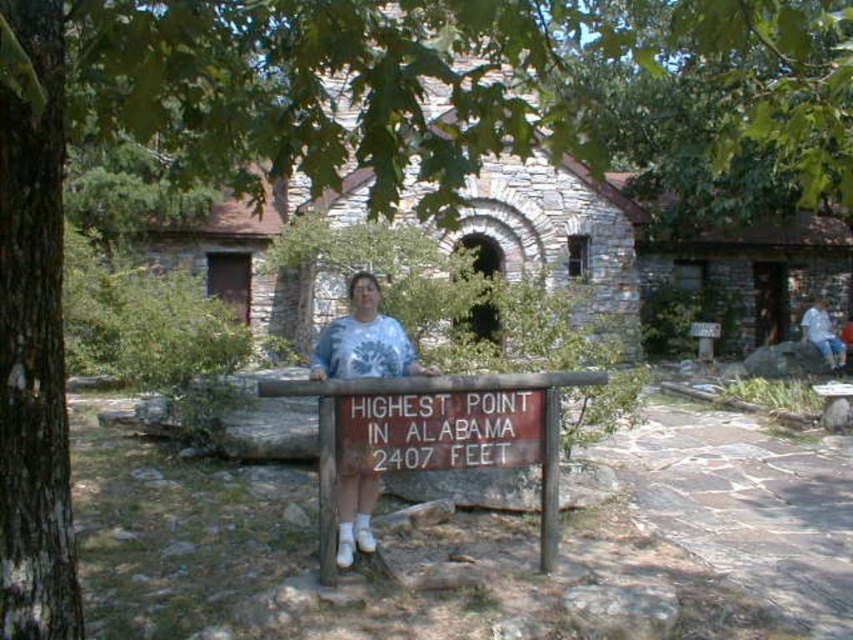
You are standing at the highest point in Alabama and want to take a photo with the brown wooden sign at center. You notice the blue denim jeans at right in the frame. To ensure the entire sign is visible, should you move closer to or farther from the sign?

The brown wooden sign at center might be wider than blue denim jeans at right, so you should move closer to the sign to ensure its entire width fits in the photo frame.

You are a photographer planning to take a photo of the brown wooden sign at center and the blue denim jeans at right. Based on their positions, which object should appear closer to the camera in the final photo?

The brown wooden sign at center should appear closer to the camera in the final photo because it is positioned in front of the blue denim jeans at right.